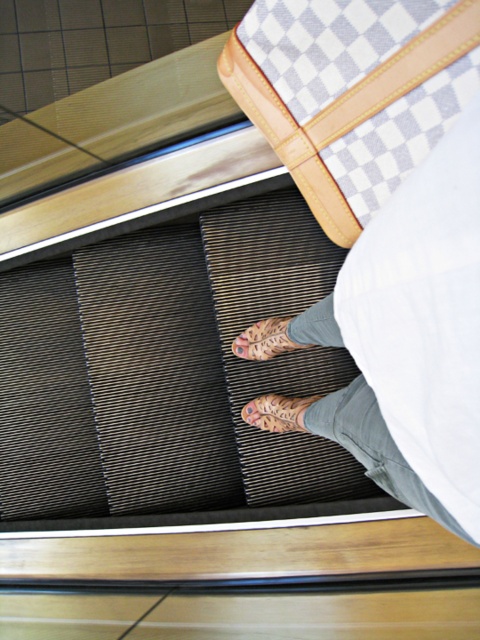
You are a delivery robot on the escalator. You need to place a package at the point marked as point (347, 292). The package is 70 centimeters wide. Can you fit it there?

The point (347, 292) is 69.57 centimeters from the camera. Since the package is 70 centimeters wide, it is slightly wider than the available space. Therefore, the package cannot be placed there.

You are a photographer trying to capture a photo of the checkered bag with a light gray and white pattern and the metallic frame of the escalator. You notice two points marked in the image at coordinates point (403, 476) and point (324, 28). Which point should you focus on to ensure the checkered bag with a light gray and white pattern is in sharp focus?

Point (403, 476) is closer to the camera than point (324, 28), so focusing on point (403, 476) will ensure the checkered bag with a light gray and white pattern is in sharp focus.

You are a security guard at the mall and need to inspect the items in the white checkered bag at center and the leather textured shoe at center. Which item should you check first if you want to start with the one closer to you?

The white checkered bag at center is in front of the leather textured shoe at center, so you should check the white checkered bag at center first since it is closer to you.